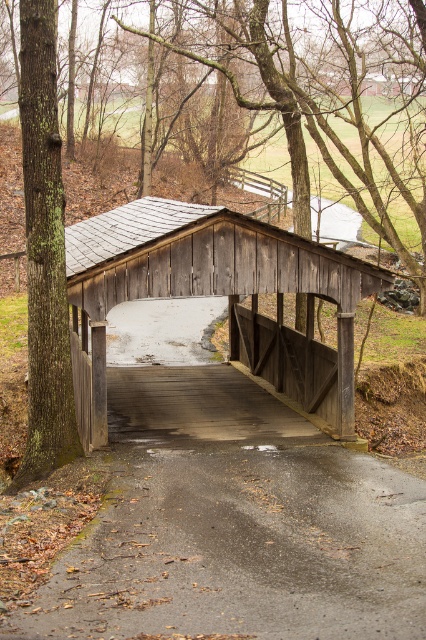
Does wooden bridge at center have a lesser height compared to green mossy bark tree at left?

Incorrect, wooden bridge at center's height does not fall short of green mossy bark tree at left's.

Who is shorter, wooden bridge at center or green mossy bark tree at left?

With less height is green mossy bark tree at left.

Is point (313, 358) positioned after point (37, 257)?

Yes, it is behind point (37, 257).

The image size is (426, 640). I want to click on wooden bridge at center, so click(216, 292).

Is smooth asphalt path at center shorter than green mossy bark tree at left?

Indeed, smooth asphalt path at center has a lesser height compared to green mossy bark tree at left.

Is smooth asphalt path at center to the right of green mossy bark tree at left from the viewer's perspective?

Yes, smooth asphalt path at center is to the right of green mossy bark tree at left.

Where is `smooth asphalt path at center`? This screenshot has width=426, height=640. smooth asphalt path at center is located at coordinates (233, 524).

Locate an element on the screen. This screenshot has width=426, height=640. smooth asphalt path at center is located at coordinates (233, 524).

Measure the distance between point (173,365) and camera.

They are 52.16 feet apart.

This screenshot has width=426, height=640. What do you see at coordinates (233, 524) in the screenshot?
I see `smooth asphalt path at center` at bounding box center [233, 524].

Which is in front, point (213, 401) or point (264, 346)?

Positioned in front is point (213, 401).

Find the location of a particular element. smooth asphalt path at center is located at coordinates (x=233, y=524).